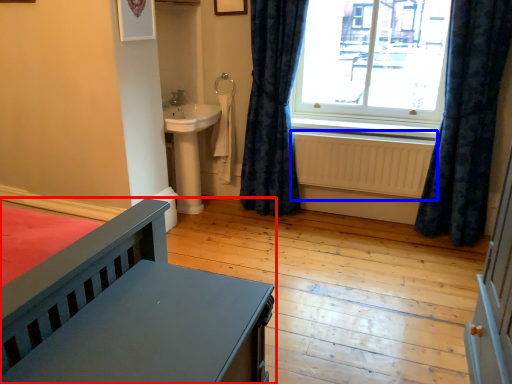
Question: Which of the following is the closest to the observer, furniture (highlighted by a red box) or radiator (highlighted by a blue box)?

Choices:
 (A) furniture
 (B) radiator

Answer: (A)